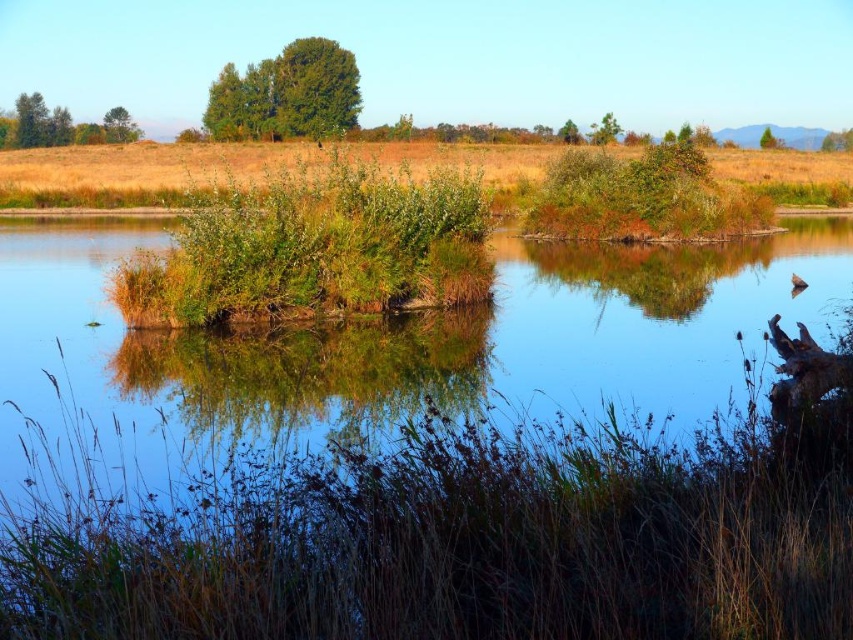
Question: Is green leafy tree at upper right smaller than green matte tree at upper center?

Choices:
 (A) yes
 (B) no

Answer: (A)

Question: Does brown dry grass at lower center lie in front of green matte tree at upper left?

Choices:
 (A) no
 (B) yes

Answer: (B)

Question: Does green leafy tree at upper left have a greater width compared to green leafy tree at upper right?

Choices:
 (A) yes
 (B) no

Answer: (A)

Question: Which point is closer to the camera?

Choices:
 (A) (561, 125)
 (B) (126, 131)
 (C) (596, 125)
 (D) (109, 125)

Answer: (B)

Question: Which point is farther from the camera taking this photo?

Choices:
 (A) (564, 124)
 (B) (177, 150)
 (C) (175, 536)
 (D) (770, 131)

Answer: (A)

Question: Which of the following is the closest to the observer?

Choices:
 (A) green leafy tree at upper center
 (B) brown dry grass at lower center
 (C) green matte tree at upper left

Answer: (B)